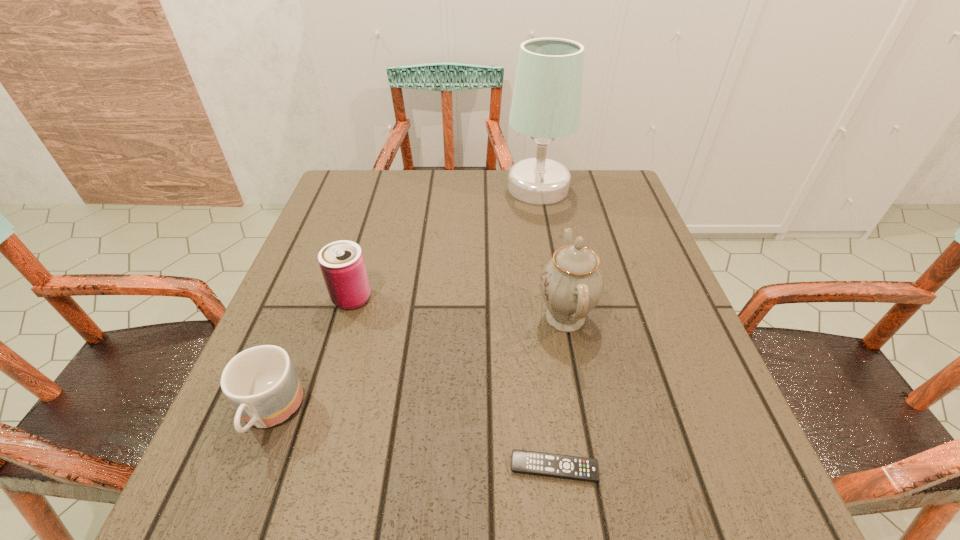
Locate an element on the screen. The height and width of the screenshot is (540, 960). object located in the far right corner section of the desktop is located at coordinates (546, 105).

The width and height of the screenshot is (960, 540). In order to click on vacant space at the far edge of the desktop in this screenshot , I will do `click(408, 172)`.

Identify the location of vacant area at the near edge of the desktop. (429, 484).

The width and height of the screenshot is (960, 540). Find the location of `vacant space at the left edge`. vacant space at the left edge is located at coordinates (251, 446).

This screenshot has width=960, height=540. I want to click on vacant space at the right edge of the desktop, so click(649, 356).

At what (x,y) coordinates should I click in order to perform the action: click on vacant space at the far left corner. Please return your answer as a coordinate pair (x, y). The height and width of the screenshot is (540, 960). Looking at the image, I should click on (335, 201).

In the image, there is a desktop. Identify the location of free space at the near left corner. The image size is (960, 540). (253, 505).

Where is `vacant space at the far right corner of the desktop`? vacant space at the far right corner of the desktop is located at coordinates (615, 181).

This screenshot has width=960, height=540. I want to click on free region at the near right corner of the desktop, so click(x=738, y=528).

Find the location of a particular element. vacant space that is in between the chinaware and the third shortest object is located at coordinates (459, 308).